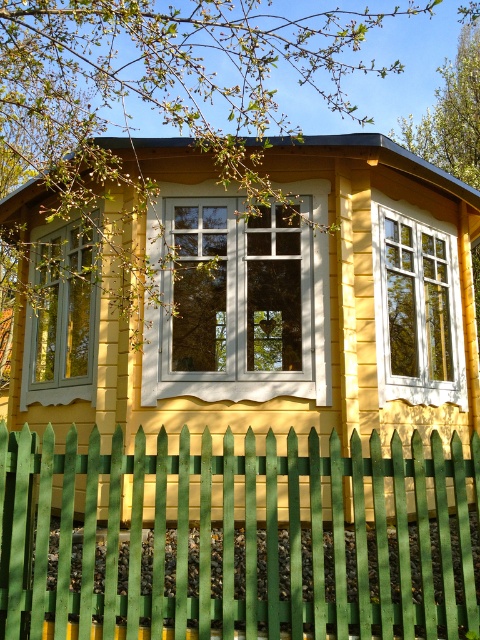
In the scene shown: You are standing in front of the yellow wooden hut at center and want to look through the white wood window at center. Can you see the window clearly from your current position?

The yellow wooden hut at center is much taller than the white wood window at center, so the window is likely positioned lower on the building. Since you are standing in front of the hut, you should be able to see the white wood window at center clearly as it is below the taller structure of the hut.

You are a painter standing at the base of the green picket fence in the foreground. You want to paint both the white painted wood window at center and the white wood window at center. Which window is farther from you?

Both the white painted wood window at center and the white wood window at center are the same window, so they are at the same distance from you.